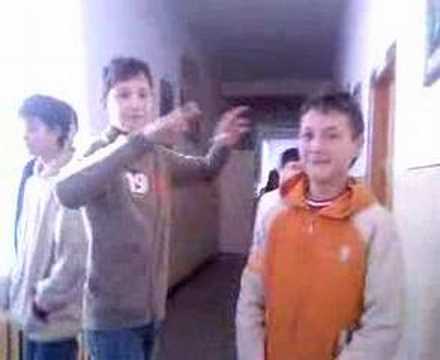
Image resolution: width=440 pixels, height=360 pixels. I want to click on ceiling, so click(x=254, y=33).